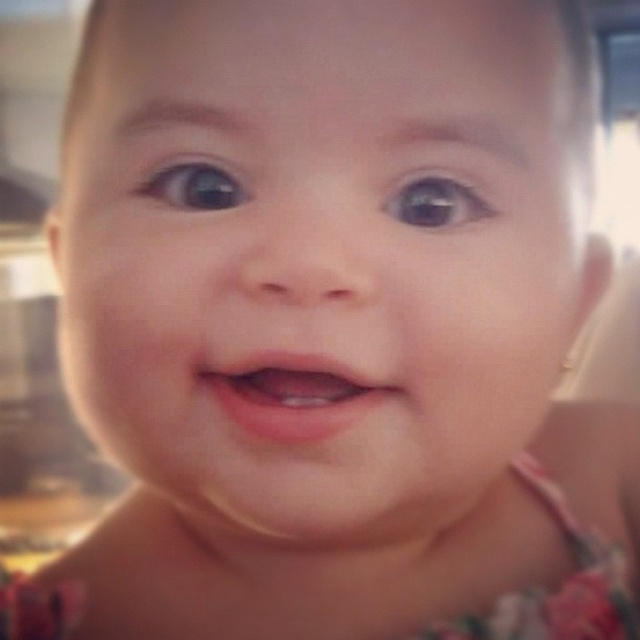
Does smooth skin baby at center appear on the left side of pink smooth lips at center?

Incorrect, smooth skin baby at center is not on the left side of pink smooth lips at center.

What do you see at coordinates (317, 256) in the screenshot? I see `smooth skin baby at center` at bounding box center [317, 256].

At what (x,y) coordinates should I click in order to perform the action: click on smooth skin baby at center. Please return your answer as a coordinate pair (x, y). Looking at the image, I should click on (317, 256).

Is pink smooth lips at center closer to the viewer compared to brown glossy eye at upper center?

Yes, it is in front of brown glossy eye at upper center.

Does pink smooth lips at center appear on the right side of brown glossy eye at upper center?

Incorrect, pink smooth lips at center is not on the right side of brown glossy eye at upper center.

Is point (241, 362) positioned before point (476, 204)?

Yes, point (241, 362) is in front of point (476, 204).

Where is `pink smooth lips at center`? The image size is (640, 640). pink smooth lips at center is located at coordinates (291, 394).

Between brown glossy eye at upper center and blue glossy eye at upper center, which one is positioned lower?

brown glossy eye at upper center is lower down.

Does brown glossy eye at upper center appear on the right side of blue glossy eye at upper center?

Correct, you'll find brown glossy eye at upper center to the right of blue glossy eye at upper center.

Who is more forward, (460, 200) or (209, 202)?

Positioned in front is point (460, 200).

At what (x,y) coordinates should I click in order to perform the action: click on brown glossy eye at upper center. Please return your answer as a coordinate pair (x, y). Looking at the image, I should click on (435, 200).